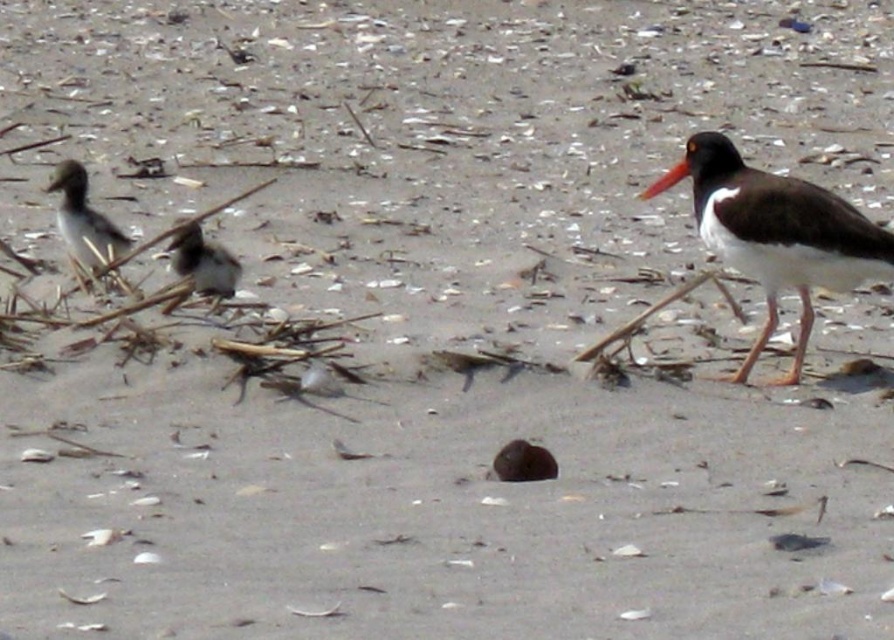
You are a birdwatcher observing the beach scene. You notice the brown feathered bird at left and the brown speckled feathers at center. Which object is located higher in the image?

The brown feathered bird at left is positioned over the brown speckled feathers at center, so it is higher in the image.

You are a birdwatcher observing the beach scene. You notice the brown feathered bird at left and the orange beak at right. Which of these two objects is taller?

The brown feathered bird at left is taller than the orange beak at right.